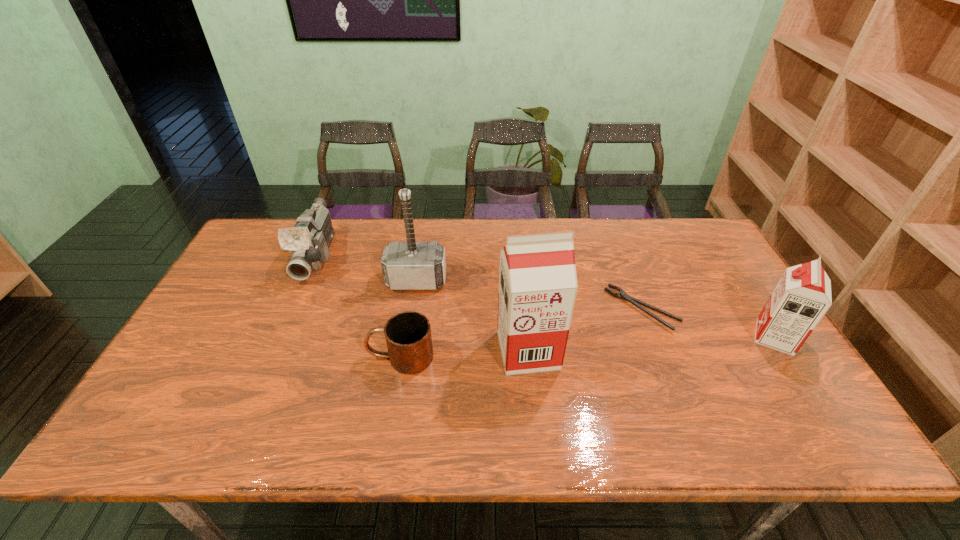
Identify the location of vacant point located between the fourth tallest object and the tallest object. (422, 303).

Locate an element on the screen. The image size is (960, 540). vacant area between the hammer and the tallest object is located at coordinates (472, 315).

Locate an element on the screen. Image resolution: width=960 pixels, height=540 pixels. vacant area that lies between the tongs and the right soya milk is located at coordinates (708, 323).

Select which object appears as the second closest to the fourth object from left to right. Please provide its 2D coordinates. Your answer should be formatted as a tuple, i.e. [(x, y)], where the tuple contains the x and y coordinates of a point satisfying the conditions above.

[(408, 336)]

Identify which object is located as the nearest to the fifth object from left to right. Please provide its 2D coordinates. Your answer should be formatted as a tuple, i.e. [(x, y)], where the tuple contains the x and y coordinates of a point satisfying the conditions above.

[(801, 298)]

The image size is (960, 540). Find the location of `free space that satisfies the following two spatial constraints: 1. for striking with the head of the right soya milk; 2. on the left side of the hammer`. free space that satisfies the following two spatial constraints: 1. for striking with the head of the right soya milk; 2. on the left side of the hammer is located at coordinates (408, 337).

Where is `free location that satisfies the following two spatial constraints: 1. for striking with the head of the right soya milk; 2. on the left side of the hammer`? The width and height of the screenshot is (960, 540). free location that satisfies the following two spatial constraints: 1. for striking with the head of the right soya milk; 2. on the left side of the hammer is located at coordinates (408, 337).

You are a GUI agent. You are given a task and a screenshot of the screen. Output one action in this format:
    pyautogui.click(x=<x>, y=<y>)
    Task: Click on the free location that satisfies the following two spatial constraints: 1. for striking with the head of the hammer; 2. on the left side of the shortest object
    The height and width of the screenshot is (540, 960).
    Given the screenshot: What is the action you would take?
    pyautogui.click(x=412, y=309)

At what (x,y) coordinates should I click in order to perform the action: click on free point that satisfies the following two spatial constraints: 1. for striking with the head of the hammer; 2. on the side of the mug with the handle. Please return your answer as a coordinate pair (x, y). This screenshot has height=540, width=960. Looking at the image, I should click on point(405,357).

You are a GUI agent. You are given a task and a screenshot of the screen. Output one action in this format:
    pyautogui.click(x=<x>, y=<y>)
    Task: Click on the blank area in the image that satisfies the following two spatial constraints: 1. for striking with the head of the hammer; 2. on the right side of the shortest object
    The height and width of the screenshot is (540, 960).
    Given the screenshot: What is the action you would take?
    pyautogui.click(x=412, y=309)